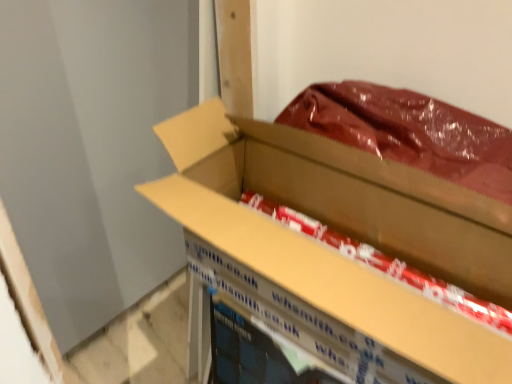
What do you see at coordinates (387, 265) in the screenshot? The height and width of the screenshot is (384, 512). I see `red glossy paper at center` at bounding box center [387, 265].

Find the location of a particular element. red glossy paper at center is located at coordinates (387, 265).

Identify the location of cardboard box at center. (336, 250).

What do you see at coordinates (336, 250) in the screenshot?
I see `cardboard box at center` at bounding box center [336, 250].

The image size is (512, 384). What are the coordinates of `red glossy paper at center` in the screenshot? It's located at (387, 265).

Which is more to the right, cardboard box at center or red glossy paper at center?

Positioned to the right is red glossy paper at center.

Does cardboard box at center lie behind red glossy paper at center?

No, cardboard box at center is in front of red glossy paper at center.

Which is closer, (333,353) or (480,314)?

Point (480,314)

From the image's perspective, who appears lower, cardboard box at center or red glossy paper at center?

cardboard box at center.

From a real-world perspective, is cardboard box at center on top of red glossy paper at center?

Yes, from a real-world perspective, cardboard box at center is on top of red glossy paper at center.

Between cardboard box at center and red glossy paper at center, which one has smaller width?

cardboard box at center is thinner.

Considering the sizes of cardboard box at center and red glossy paper at center in the image, is cardboard box at center taller or shorter than red glossy paper at center?

cardboard box at center is taller than red glossy paper at center.

From the picture: Does cardboard box at center have a smaller size compared to red glossy paper at center?

No.

Is red glossy paper at center located within cardboard box at center?

That's correct, red glossy paper at center is inside cardboard box at center.

Would you say cardboard box at center is a long distance from red glossy paper at center?

cardboard box at center is actually quite close to red glossy paper at center.

Is cardboard box at center facing away from red glossy paper at center?

Correct, cardboard box at center is looking away from red glossy paper at center.

How many degrees apart are the facing directions of cardboard box at center and red glossy paper at center?

They differ by 89.6 degrees in their facing directions.

Locate an element on the screen. This screenshot has width=512, height=384. wrapping paper behind the cardboard box at center is located at coordinates coord(387,265).

In the image, is red glossy paper at center on the left side or the right side of cardboard box at center?

red glossy paper at center is to the right of cardboard box at center.

Consider the image. Which object is further away from the camera, red glossy paper at center or cardboard box at center?

red glossy paper at center.

Does point (298, 215) come behind point (372, 185)?

Yes, point (298, 215) is farther from viewer.

From the image's perspective, is red glossy paper at center located above or below cardboard box at center?

From the image's perspective, red glossy paper at center appears above cardboard box at center.

From a real-world perspective, is red glossy paper at center over cardboard box at center?

No, from a real-world perspective, red glossy paper at center is not on top of cardboard box at center.

Does red glossy paper at center have a lesser width compared to cardboard box at center?

In fact, red glossy paper at center might be wider than cardboard box at center.

Considering the relative sizes of red glossy paper at center and cardboard box at center in the image provided, is red glossy paper at center taller than cardboard box at center?

Incorrect, the height of red glossy paper at center is not larger of that of cardboard box at center.

Who is bigger, red glossy paper at center or cardboard box at center?

cardboard box at center is bigger.

Is red glossy paper at center not inside cardboard box at center?

That's incorrect, red glossy paper at center is not completely outside cardboard box at center.

Is red glossy paper at center directly adjacent to cardboard box at center?

No, red glossy paper at center is not with cardboard box at center.

Is red glossy paper at center facing away from cardboard box at center?

Correct, red glossy paper at center is looking away from cardboard box at center.

The height and width of the screenshot is (384, 512). Identify the location of box in front of the red glossy paper at center. (336, 250).

Locate an element on the screen. The height and width of the screenshot is (384, 512). box below the red glossy paper at center (from the image's perspective) is located at coordinates (336, 250).

The width and height of the screenshot is (512, 384). I want to click on box that appears on the left of red glossy paper at center, so click(x=336, y=250).